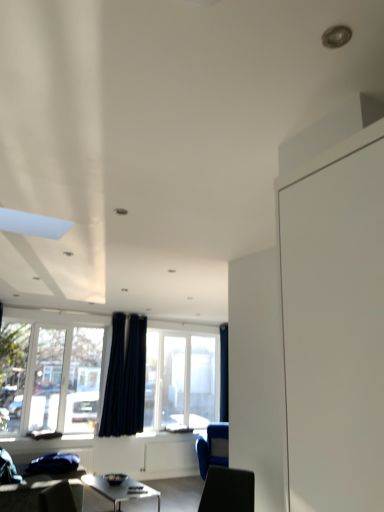
Question: Is point (223, 387) closer or farther from the camera than point (54, 409)?

Choices:
 (A) closer
 (B) farther

Answer: (B)

Question: Would you say dark blue fabric curtain at upper center, the first curtain when ordered from back to front, is inside or outside transparent glass window at lower left, the 1th window positioned from the front?

Choices:
 (A) outside
 (B) inside

Answer: (A)

Question: Which object is the closest to the dark blue fabric curtain at center, marked as the first curtain in a left-to-right arrangement?

Choices:
 (A) dark blue fabric curtain at upper center, the first curtain in the right-to-left sequence
 (B) blue fabric armchair at lower right
 (C) transparent glass window at lower left, the 1th window positioned from the front
 (D) transparent glass window at center, placed as the second window when sorted from left to right

Answer: (D)

Question: Which is nearer to the dark blue fabric curtain at upper center, the first curtain when ordered from back to front?

Choices:
 (A) dark blue fabric curtain at center, the 2th curtain viewed from the back
 (B) transparent glass window at center, which appears as the 2th window when viewed from the front
 (C) transparent glass window at lower left, acting as the 2th window starting from the right
 (D) blue fabric armchair at lower right

Answer: (B)